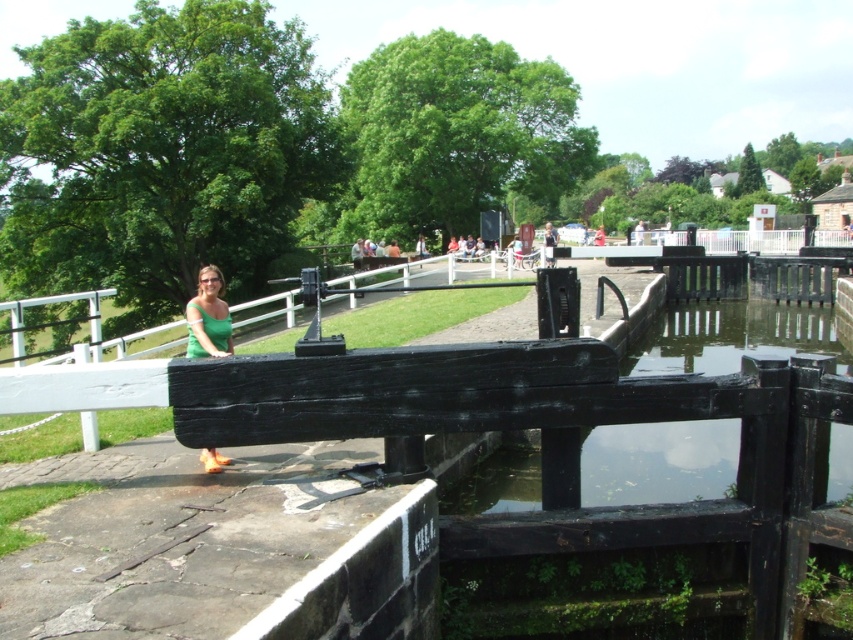
Consider the image. You are a photographer trying to capture the transparent water at lock center in your shot. Based on its coordinates, where should you position your camera to ensure it is centered in the frame?

To center the transparent water at lock center in your frame, position your camera so that it aligns with the coordinates point (659, 461).

You are standing at the canal lock and want to take a photo of the transparent water at lock center while also including the green matte shirt at center in the frame. Which object should be positioned to the right side of your camera view?

The transparent water at lock center should be positioned to the right side of your camera view because it is already located to the right of the green matte shirt at center.